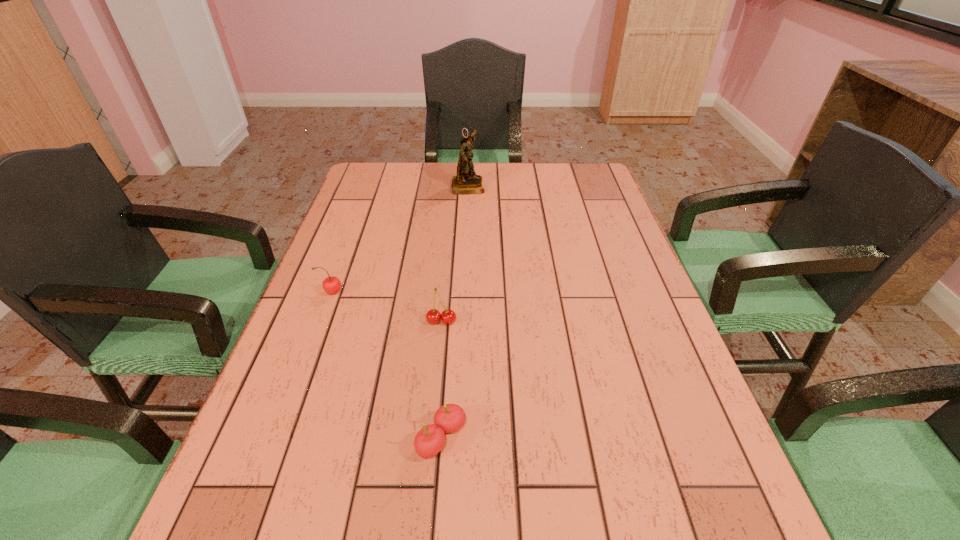
Identify which cherry is located as the second nearest to the nearest object. Please provide its 2D coordinates. Your answer should be formatted as a tuple, i.e. [(x, y)], where the tuple contains the x and y coordinates of a point satisfying the conditions above.

[(331, 285)]

Locate an element on the screen. vacant space that satisfies the following two spatial constraints: 1. on the front-facing side of the tallest object; 2. on the front side of the farthest cherry is located at coordinates (464, 292).

Where is `vacant space that satisfies the following two spatial constraints: 1. with the stems of the second nearest object pointing upwards; 2. on the left side of the nearest cherry`? This screenshot has width=960, height=540. vacant space that satisfies the following two spatial constraints: 1. with the stems of the second nearest object pointing upwards; 2. on the left side of the nearest cherry is located at coordinates (431, 438).

You are a GUI agent. You are given a task and a screenshot of the screen. Output one action in this format:
    pyautogui.click(x=<x>, y=<y>)
    Task: Click on the free space that satisfies the following two spatial constraints: 1. on the front-facing side of the figurine; 2. with the stems of the third farthest object pointing upwards
    
    Given the screenshot: What is the action you would take?
    pyautogui.click(x=463, y=321)

Locate an element on the screen. Image resolution: width=960 pixels, height=540 pixels. blank area in the image that satisfies the following two spatial constraints: 1. on the front-facing side of the tallest object; 2. with the stems of the second farthest cherry pointing upwards is located at coordinates (463, 321).

You are a GUI agent. You are given a task and a screenshot of the screen. Output one action in this format:
    pyautogui.click(x=<x>, y=<y>)
    Task: Click on the vacant space that satisfies the following two spatial constraints: 1. on the front-facing side of the farthest object; 2. with the stems of the second nearest cherry pointing upwards
    The image size is (960, 540).
    Given the screenshot: What is the action you would take?
    pyautogui.click(x=463, y=321)

The height and width of the screenshot is (540, 960). What are the coordinates of `free space that satisfies the following two spatial constraints: 1. on the front-facing side of the figurine; 2. with the stems of the third farthest object pointing upwards` in the screenshot? It's located at (463, 321).